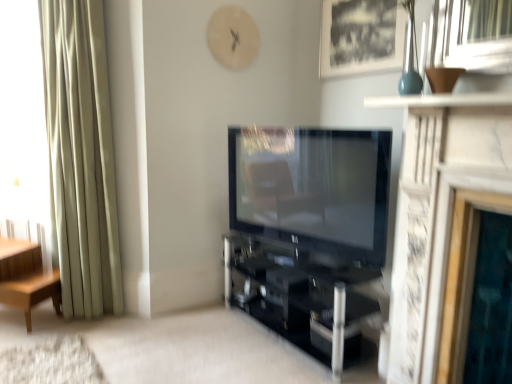
Question: Do you think white marble fireplace at center is within black glass shelf at center, or outside of it?

Choices:
 (A) outside
 (B) inside

Answer: (A)

Question: Visually, is white marble fireplace at center positioned to the left or to the right of black glass shelf at center?

Choices:
 (A) left
 (B) right

Answer: (B)

Question: Estimate the real-world distances between objects in this image. Which object is farther from the light brown wood side table at left?

Choices:
 (A) black glass shelf at center
 (B) matte black tv at center
 (C) silky beige curtain at left
 (D) black matte picture frame at upper center
 (E) white marble fireplace at center

Answer: (D)

Question: Based on their relative distances, which object is farther from the light brown wood side table at left?

Choices:
 (A) black glass shelf at center
 (B) white marble fireplace at center
 (C) black matte picture frame at upper center
 (D) silky beige curtain at left
 (E) matte black tv at center

Answer: (C)